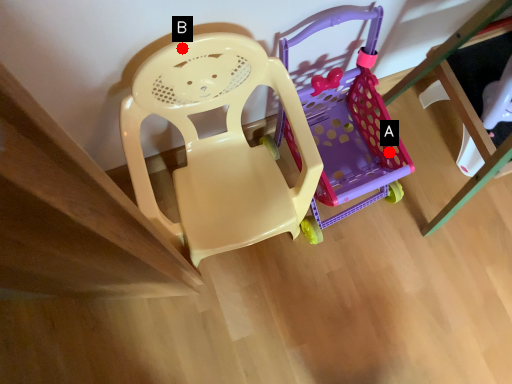
Question: Two points are circled on the image, labeled by A and B beside each circle. Among these points, which one is nearest to the camera?

Choices:
 (A) A is closer
 (B) B is closer

Answer: (B)